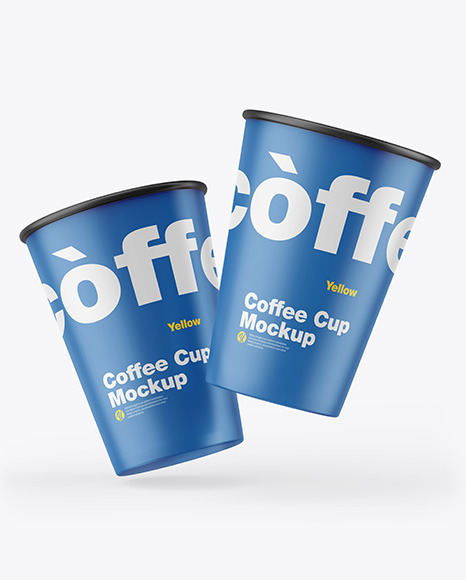
At what (x,y) coordinates should I click in order to perform the action: click on cup of the left. Please return your answer as a coordinate pair (x, y). Looking at the image, I should click on (152, 438).